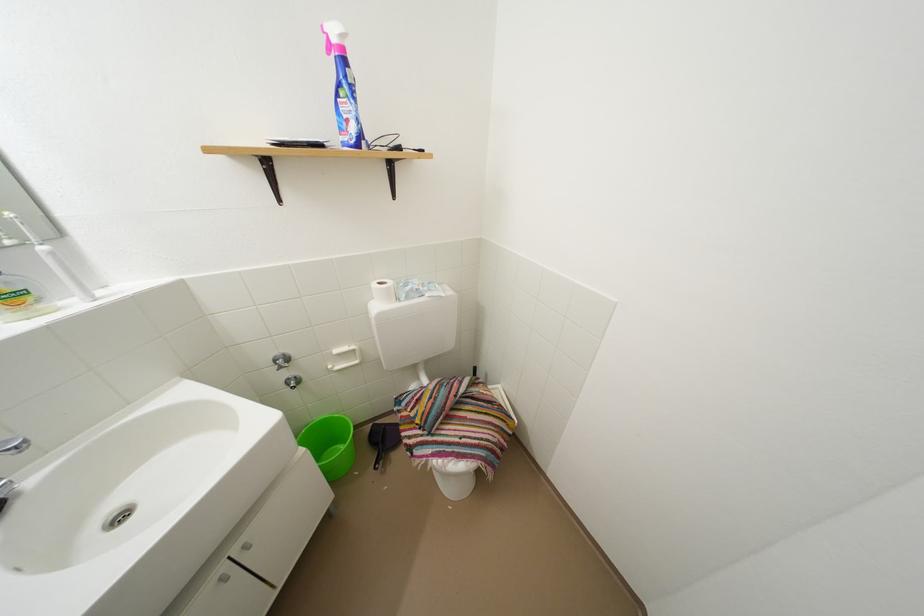
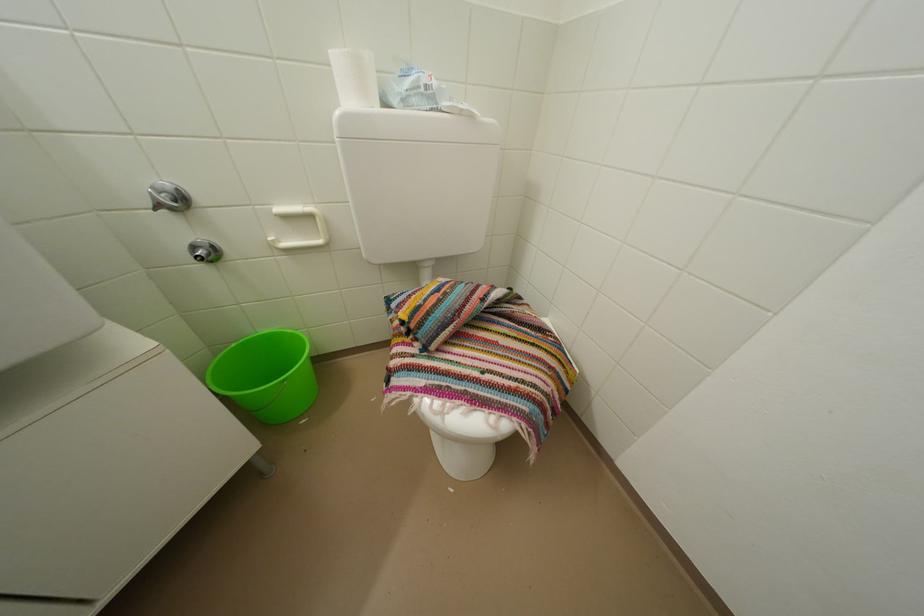
Question: How did the camera likely rotate?

Choices:
 (A) Left
 (B) Right
 (C) Up
 (D) Down

Answer: (D)